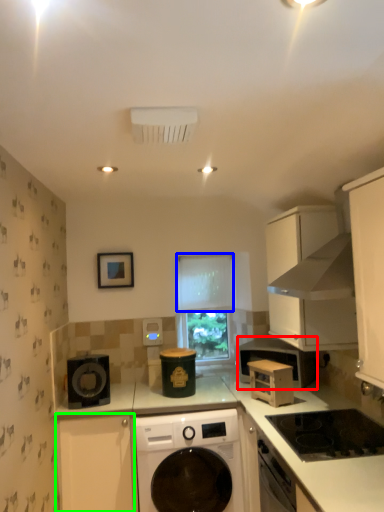
Question: Based on their relative distances, which object is farther from home appliance (highlighted by a red box)? Choose from curtain (highlighted by a blue box) and cabinetry (highlighted by a green box).

Choices:
 (A) curtain
 (B) cabinetry

Answer: (B)